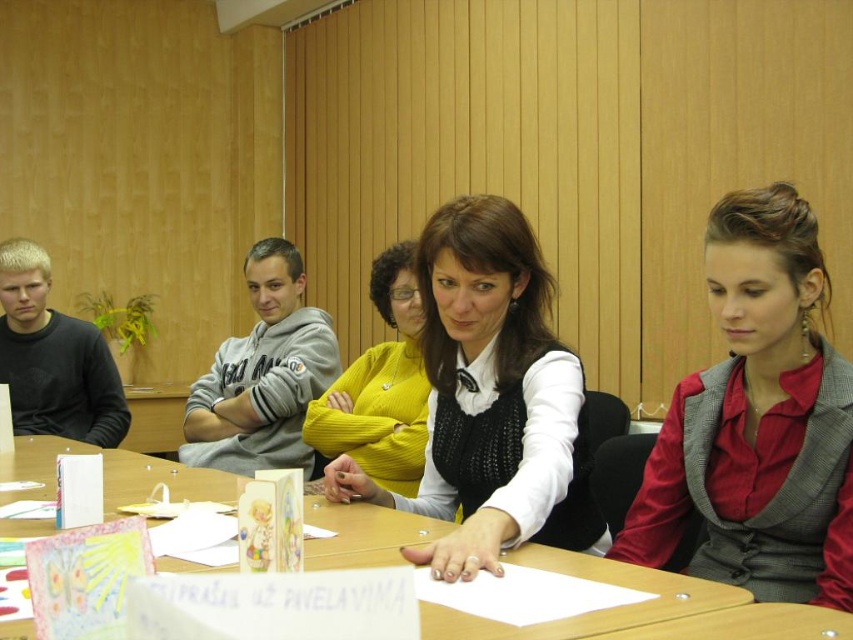
Question: Can you confirm if matte black vest at center is thinner than wooden table at center?

Choices:
 (A) no
 (B) yes

Answer: (B)

Question: Which point is farther from the camera taking this photo?

Choices:
 (A) (398, 301)
 (B) (492, 326)

Answer: (A)

Question: In this image, where is red fabric vest at center located relative to matte black vest at center?

Choices:
 (A) left
 (B) right

Answer: (B)

Question: Which object appears closest to the camera in this image?

Choices:
 (A) wooden table at center
 (B) matte yellow sweater at center
 (C) red fabric vest at center
 (D) matte black vest at center

Answer: (A)

Question: Does gray fleece sweatshirt at center have a smaller size compared to matte yellow sweater at center?

Choices:
 (A) no
 (B) yes

Answer: (A)

Question: Which object is the farthest from the wooden table at center?

Choices:
 (A) gray fleece sweatshirt at center
 (B) matte yellow sweater at center
 (C) red fabric vest at center
 (D) matte black vest at center

Answer: (A)